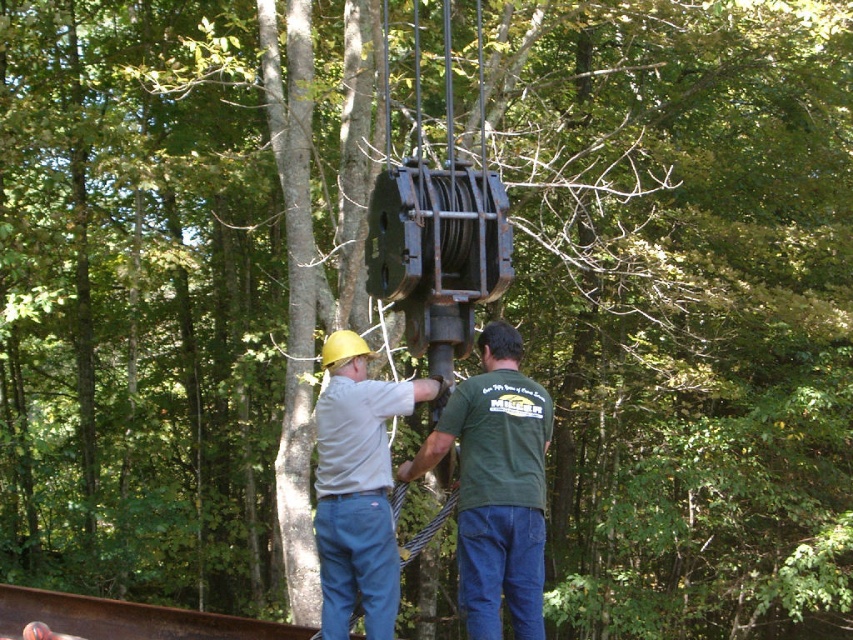
Question: Which point is closer to the camera?

Choices:
 (A) (349, 362)
 (B) (448, 413)

Answer: (B)

Question: Is green matte shirt at center closer to camera compared to matte yellow hard hat at center?

Choices:
 (A) yes
 (B) no

Answer: (A)

Question: Does green matte shirt at center come in front of matte yellow hard hat at center?

Choices:
 (A) yes
 (B) no

Answer: (A)

Question: Which object is farther from the camera taking this photo?

Choices:
 (A) green matte shirt at center
 (B) matte yellow hard hat at center

Answer: (B)

Question: Does green matte shirt at center have a larger size compared to matte yellow hard hat at center?

Choices:
 (A) yes
 (B) no

Answer: (A)